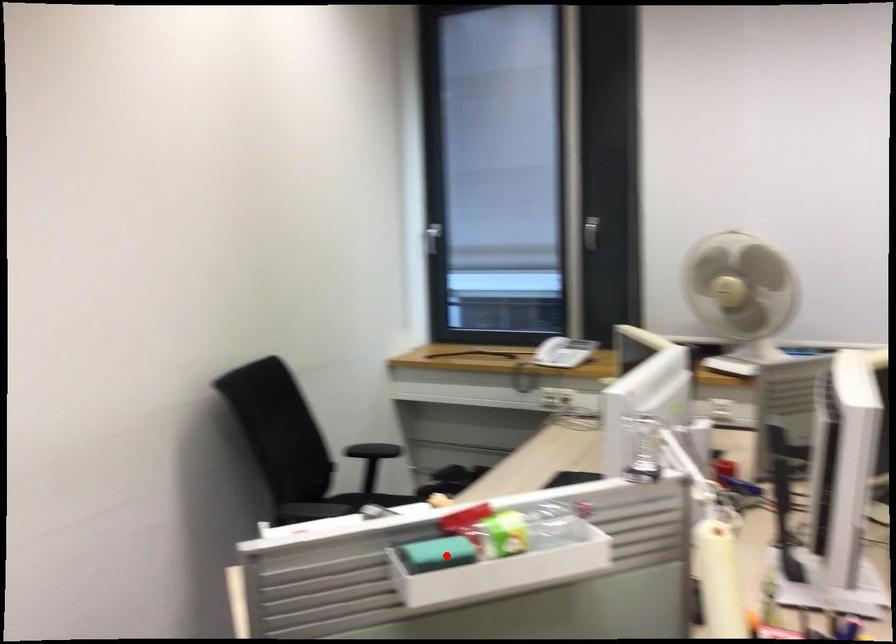
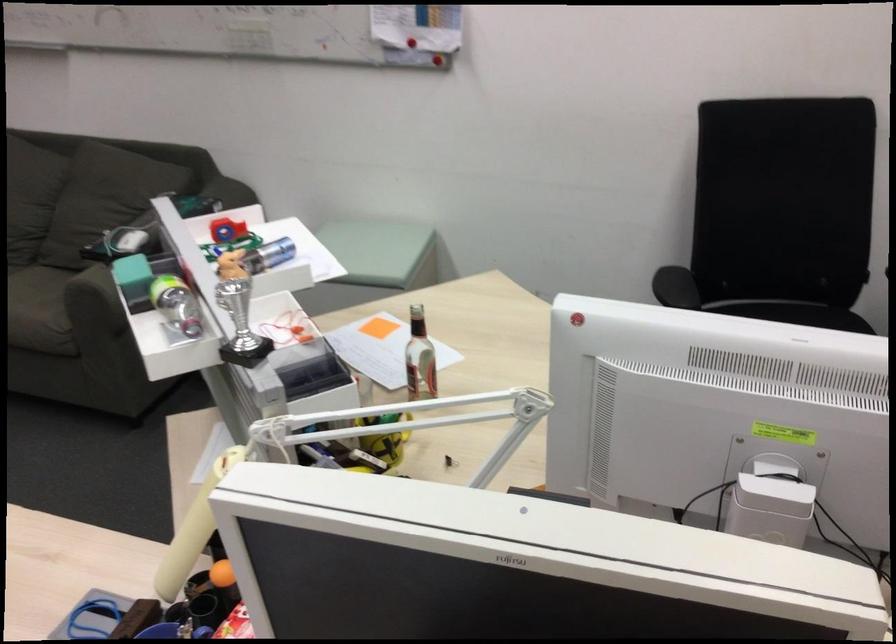
The point at the highlighted location is marked in the first image. Where is the corresponding point in the second image?

(240, 324)